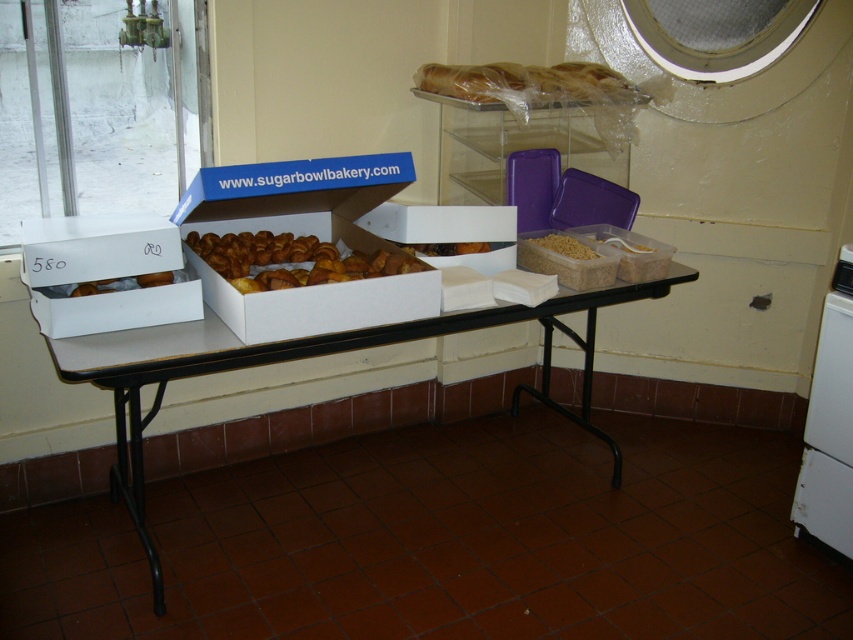
Question: Which of the following is the farthest from the observer?

Choices:
 (A) (196, 252)
 (B) (166, 298)

Answer: (A)

Question: Which point is farther to the camera?

Choices:
 (A) brown matte pasta at center
 (B) white plastic refrigerator at lower right
 (C) white cardboard boxes at center

Answer: (A)

Question: Considering the relative positions of golden brown doughnut at center and golden brown bread at upper center in the image provided, where is golden brown doughnut at center located with respect to golden brown bread at upper center?

Choices:
 (A) left
 (B) right

Answer: (A)

Question: Based on their relative distances, which object is farther from the brown matte pasta at center?

Choices:
 (A) white cardboard boxes at center
 (B) white cardboard box at left
 (C) golden brown bread at upper center

Answer: (B)

Question: Is white plastic refrigerator at lower right thinner than brown matte pasta at center?

Choices:
 (A) no
 (B) yes

Answer: (B)

Question: Is white cardboard box at left below golden brown bread at upper center?

Choices:
 (A) no
 (B) yes

Answer: (B)